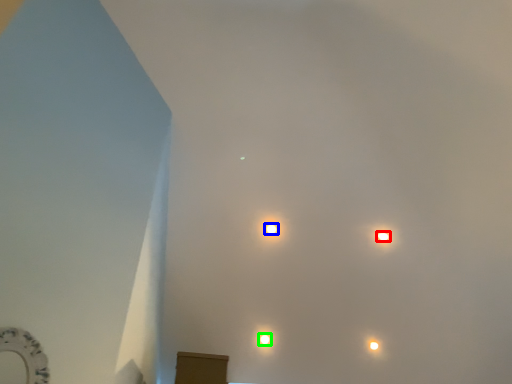
Question: Based on their relative distances, which object is nearer to lamp (highlighted by a red box)? Choose from lamp (highlighted by a blue box) and lamp (highlighted by a green box).

Choices:
 (A) lamp
 (B) lamp

Answer: (A)